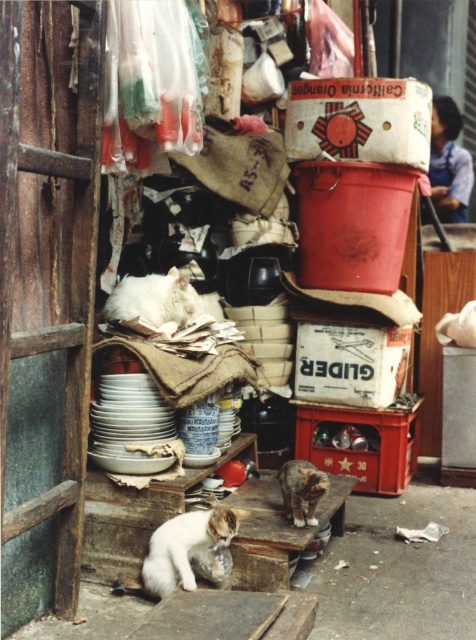
Based on the photo, you are trying to figure out the positions of the cats in the storage area. According to the image, is the white fluffy cat at lower left positioned above or below the white fluffy cat at center?

The white fluffy cat at lower left is located below the white fluffy cat at center.

You are standing in the storage area and want to reach a box located behind the white fluffy cat at lower left. If you can stretch your arm 10 feet, can you safely reach the box without getting too close to the cat?

The white fluffy cat at lower left is 10.10 feet away from you. Since your arm can only stretch 10 feet, you cannot safely reach the box behind the cat without getting closer.

Please provide the coordinates of the white fluffy cat at center in the image.

The white fluffy cat at center is located at coordinates point (152, 300).